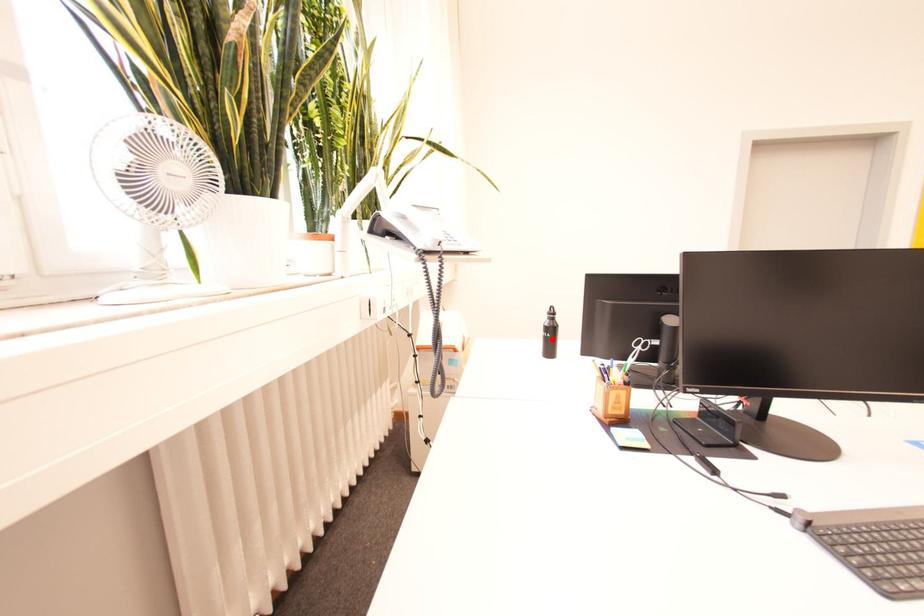
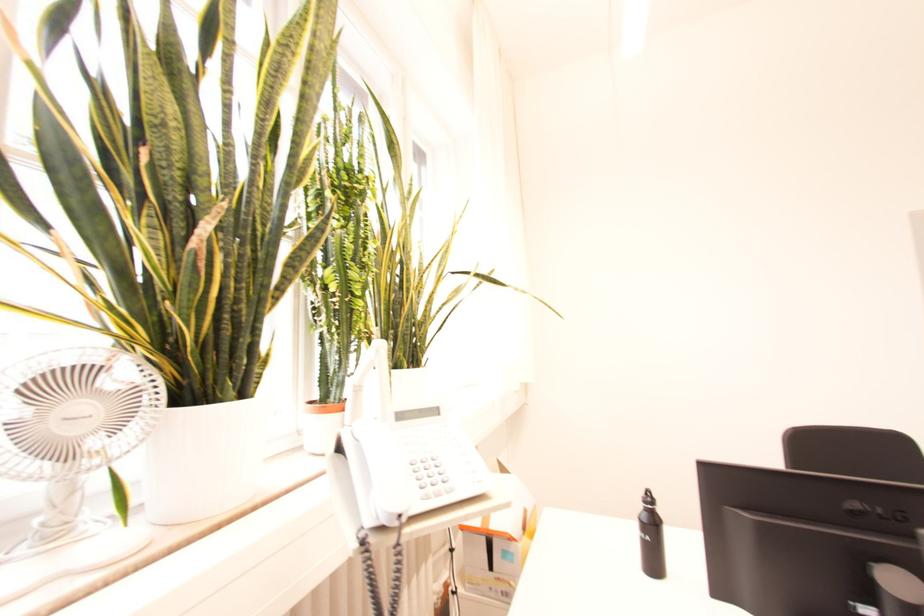
The point at the highlighted location is marked in the first image. Where is the corresponding point in the second image?

(650, 543)